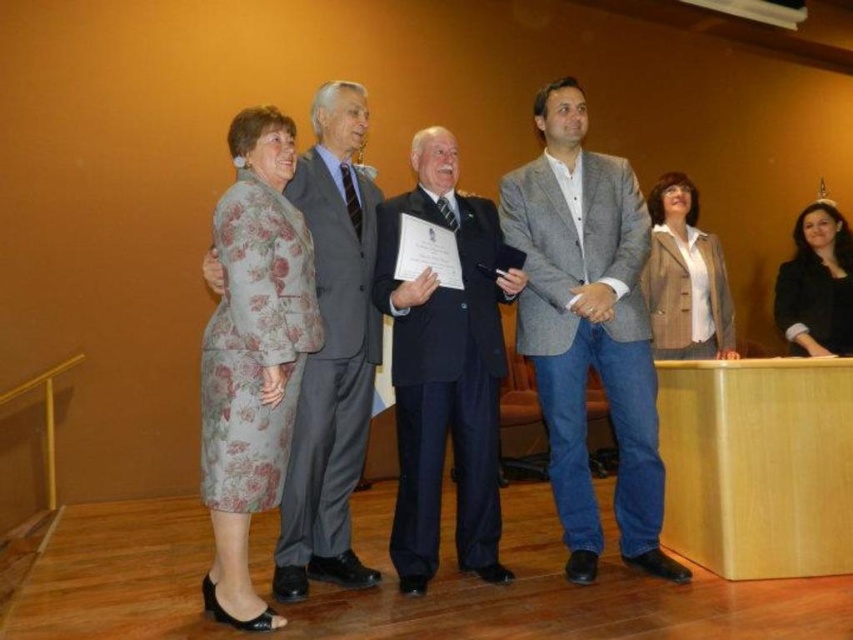
Which is behind, point (223, 324) or point (306, 413)?

Positioned behind is point (306, 413).

Who is shorter, floral fabric dress at left or gray wool suit at left?

With less height is gray wool suit at left.

The image size is (853, 640). Find the location of `floral fabric dress at left`. floral fabric dress at left is located at coordinates (252, 355).

You are a GUI agent. You are given a task and a screenshot of the screen. Output one action in this format:
    pyautogui.click(x=<x>, y=<y>)
    Task: Click on the floral fabric dress at left
    The height and width of the screenshot is (640, 853).
    Given the screenshot: What is the action you would take?
    pyautogui.click(x=252, y=355)

At what (x,y) coordinates should I click in order to perform the action: click on dark blue suit at center. Please return your answer as a coordinate pair (x, y). The height and width of the screenshot is (640, 853). Looking at the image, I should click on (445, 371).

The image size is (853, 640). Identify the location of dark blue suit at center. (445, 371).

Can you confirm if gray wool blazer at center is positioned to the left of gray wool suit at left?

No, gray wool blazer at center is not to the left of gray wool suit at left.

Consider the image. Between gray wool blazer at center and gray wool suit at left, which one is positioned higher?

gray wool blazer at center

Who is more forward, (581, 195) or (296, 176)?

Point (296, 176) is more forward.

I want to click on gray wool blazer at center, so click(x=589, y=328).